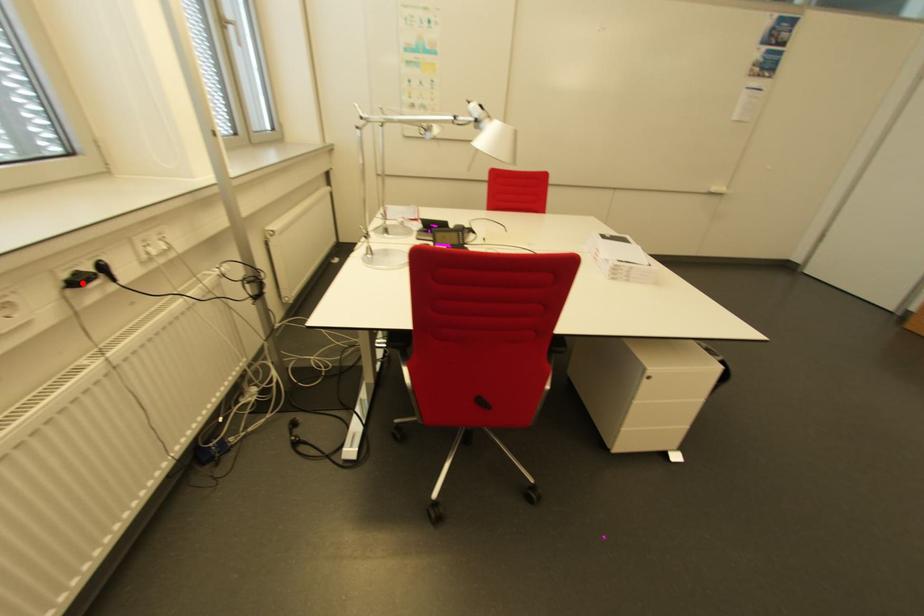
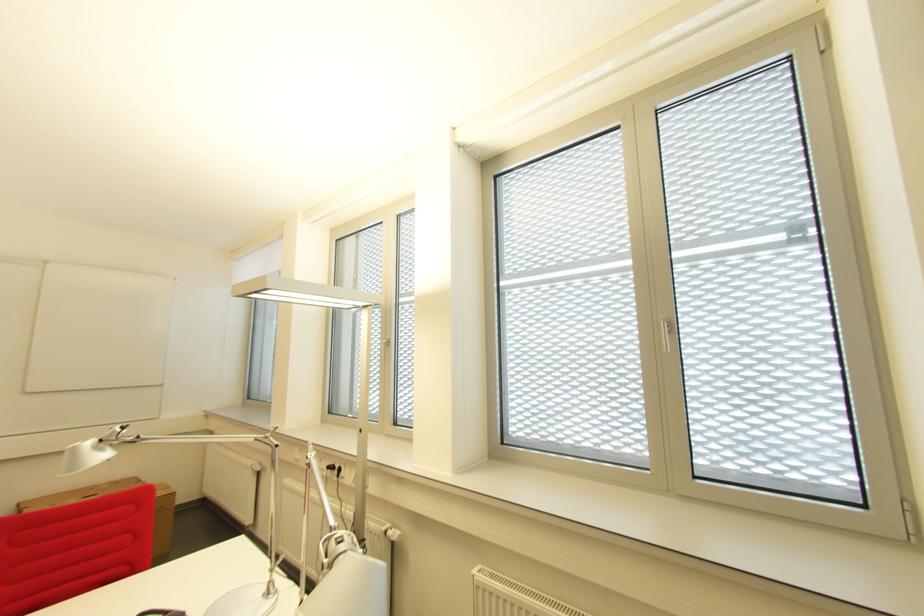
Find the pixel in the second image that matches the highlighted location in the first image.

(337, 469)